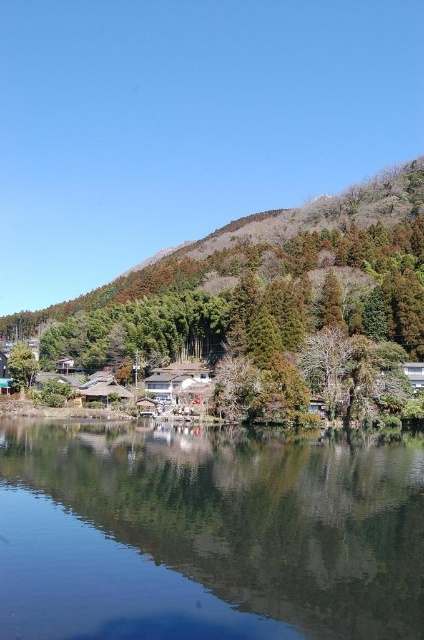
Question: Which object appears farthest from the camera in this image?

Choices:
 (A) green leafy hillside at upper center
 (B) transparent glass water at lower center

Answer: (A)

Question: Is transparent glass water at lower center smaller than green leafy hillside at upper center?

Choices:
 (A) yes
 (B) no

Answer: (A)

Question: Does transparent glass water at lower center appear under green leafy hillside at upper center?

Choices:
 (A) no
 (B) yes

Answer: (B)

Question: Which object is farther from the camera taking this photo?

Choices:
 (A) transparent glass water at lower center
 (B) green leafy hillside at upper center

Answer: (B)

Question: Does transparent glass water at lower center have a lesser width compared to green leafy hillside at upper center?

Choices:
 (A) yes
 (B) no

Answer: (A)